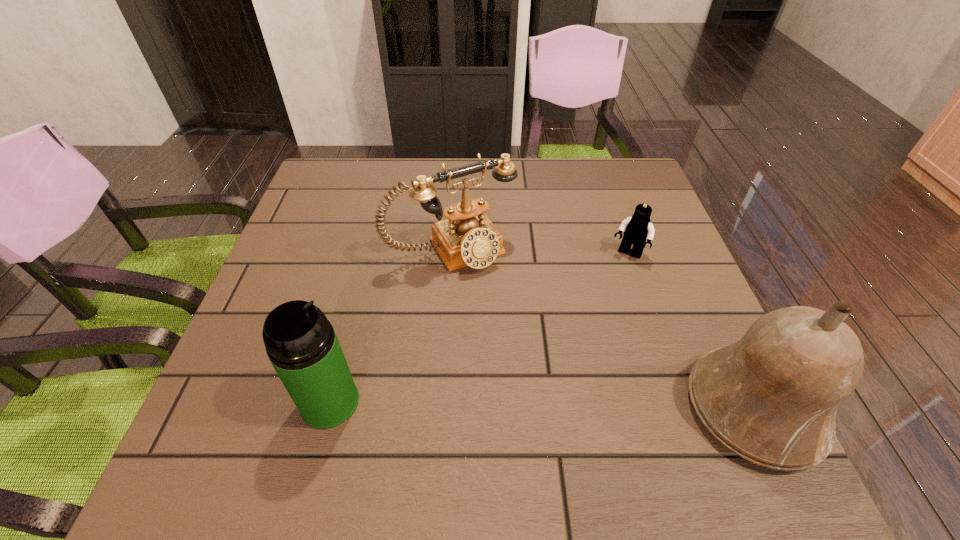
This screenshot has width=960, height=540. Identify the location of vacant region at the near edge of the desktop. (639, 415).

In the image, there is a desktop. Identify the location of free space at the left edge. The height and width of the screenshot is (540, 960). (292, 225).

The image size is (960, 540). In order to click on vacant space at the right edge in this screenshot , I will do `click(609, 217)`.

Find the location of `vacant area at the far left corner`. vacant area at the far left corner is located at coordinates tap(322, 182).

Where is `vacant region at the far right corner of the desktop`? The height and width of the screenshot is (540, 960). vacant region at the far right corner of the desktop is located at coordinates (623, 164).

You are a GUI agent. You are given a task and a screenshot of the screen. Output one action in this format:
    pyautogui.click(x=<x>, y=<y>)
    Task: Click on the free region at the near right corner
    This screenshot has width=960, height=540.
    Given the screenshot: What is the action you would take?
    pyautogui.click(x=696, y=417)

Locate an element on the screen. The width and height of the screenshot is (960, 540). vacant region between the thermos bottle and the Lego is located at coordinates (479, 328).

The height and width of the screenshot is (540, 960). Find the location of `vacant space that's between the bell and the Lego`. vacant space that's between the bell and the Lego is located at coordinates (690, 332).

In order to click on blank region between the Lego and the bell in this screenshot , I will do `click(690, 332)`.

In order to click on free spot between the bell and the thermos bottle in this screenshot , I will do `click(541, 405)`.